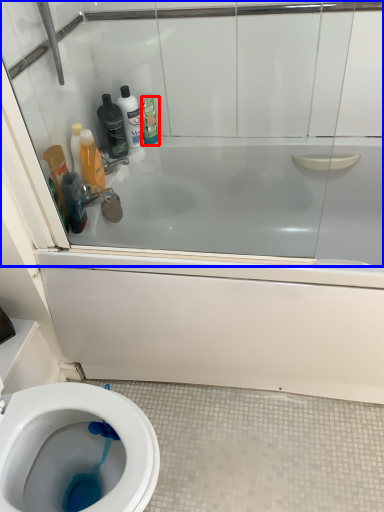
Question: Which object appears farthest to the camera in this image, cleaning product (highlighted by a red box) or glass door (highlighted by a blue box)?

Choices:
 (A) cleaning product
 (B) glass door

Answer: (A)